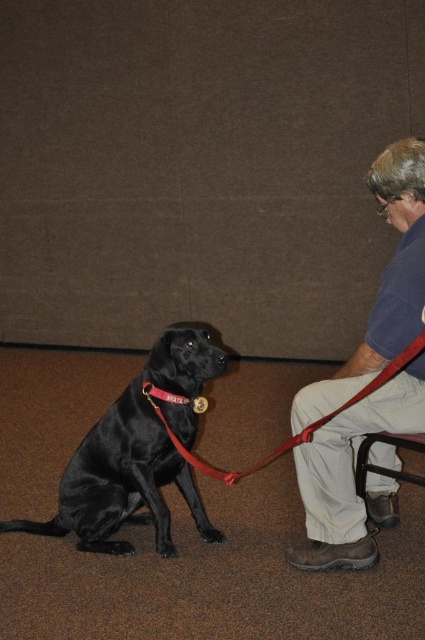
Question: Estimate the real-world distances between objects in this image. Which object is farther from the shiny black dog at center?

Choices:
 (A) red nylon leash at lower left
 (B) metallic gold dog collar at center

Answer: (B)

Question: Which object is the closest to the metallic gold dog collar at center?

Choices:
 (A) blue cotton shirt at right
 (B) shiny black dog at center

Answer: (B)

Question: Can you confirm if blue cotton shirt at right is positioned to the right of metallic gold dog collar at center?

Choices:
 (A) no
 (B) yes

Answer: (B)

Question: Can you confirm if blue cotton shirt at right is smaller than red nylon leash at lower left?

Choices:
 (A) no
 (B) yes

Answer: (A)

Question: Does blue cotton shirt at right appear under shiny black dog at center?

Choices:
 (A) no
 (B) yes

Answer: (A)

Question: Which object appears farthest from the camera in this image?

Choices:
 (A) metallic gold dog collar at center
 (B) blue cotton shirt at right
 (C) red nylon leash at lower left

Answer: (A)